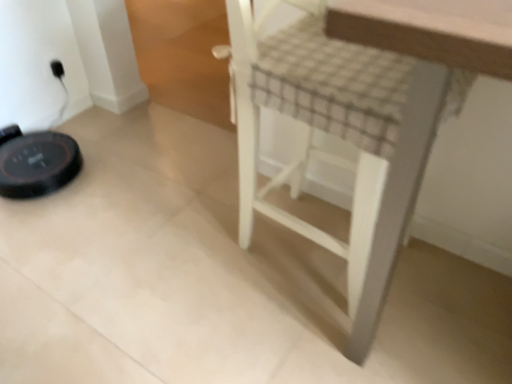
Question: From a real-world perspective, is white wood stool at center over black plastic outlet at upper left?

Choices:
 (A) no
 (B) yes

Answer: (B)

Question: Is white wood stool at center bigger than black plastic outlet at upper left?

Choices:
 (A) yes
 (B) no

Answer: (A)

Question: Can we say white wood stool at center lies outside black plastic outlet at upper left?

Choices:
 (A) no
 (B) yes

Answer: (B)

Question: Does white wood stool at center have a greater width compared to black plastic outlet at upper left?

Choices:
 (A) yes
 (B) no

Answer: (A)

Question: Does white wood stool at center appear on the right side of black plastic outlet at upper left?

Choices:
 (A) yes
 (B) no

Answer: (A)

Question: Does white wood stool at center have a lesser width compared to black plastic outlet at upper left?

Choices:
 (A) yes
 (B) no

Answer: (B)

Question: Considering the relative sizes of black plastic outlet at upper left and white wood stool at center in the image provided, is black plastic outlet at upper left taller than white wood stool at center?

Choices:
 (A) no
 (B) yes

Answer: (A)

Question: Is black plastic outlet at upper left not near white wood stool at center?

Choices:
 (A) no
 (B) yes

Answer: (B)

Question: Would you say black plastic outlet at upper left contains white wood stool at center?

Choices:
 (A) no
 (B) yes

Answer: (A)

Question: Does black plastic outlet at upper left have a larger size compared to white wood stool at center?

Choices:
 (A) yes
 (B) no

Answer: (B)

Question: Is black plastic outlet at upper left further to camera compared to white wood stool at center?

Choices:
 (A) no
 (B) yes

Answer: (B)

Question: Is black plastic outlet at upper left aimed at white wood stool at center?

Choices:
 (A) no
 (B) yes

Answer: (B)

Question: Considering the positions of white wood stool at center and black plastic outlet at upper left in the image, is white wood stool at center wider or thinner than black plastic outlet at upper left?

Choices:
 (A) thin
 (B) wide

Answer: (B)